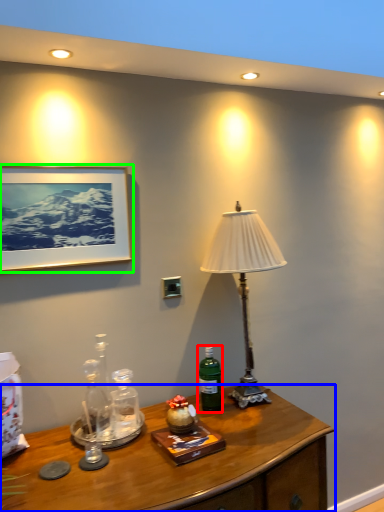
Question: Which is farther away from bottle (highlighted by a red box)? desk (highlighted by a blue box) or picture frame (highlighted by a green box)?

Choices:
 (A) desk
 (B) picture frame

Answer: (B)